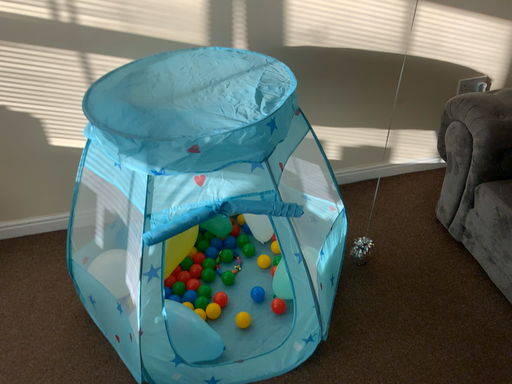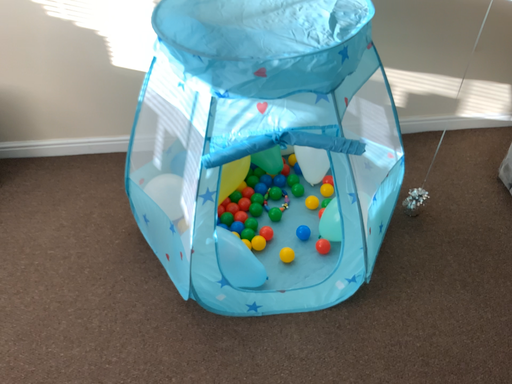
Question: How did the camera likely rotate when shooting the video?

Choices:
 (A) rotated downward
 (B) rotated upward

Answer: (A)